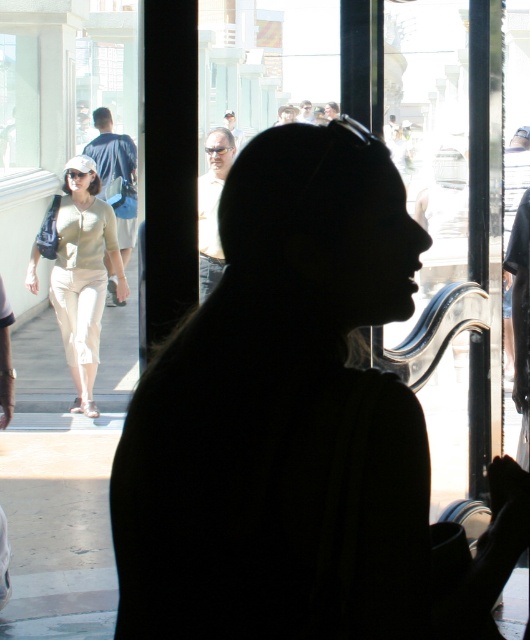
Looking at this image, you are a fashion designer observing the scene through the glass door. You notice the blue denim jacket at left and the matte beige shirt at center. Which clothing item appears larger in the image?

The blue denim jacket at left appears larger because it is much taller than the matte beige shirt at center.

You are standing in the room and looking through the glass door. You see a point at the center of the image. Is there an object at point (x=517, y=259) that could be part of a person wearing a black shirt?

Yes, the point (x=517, y=259) corresponds to the smooth black shirt at center, which is part of a person wearing a black shirt.

You are a fashion designer analyzing the clothing items in the image. Which clothing item, the smooth black shirt at center or the blue denim jacket at left, would you recommend for someone who wants to appear more dominant in a professional setting?

The smooth black shirt at center has a larger size compared to the blue denim jacket at left. In professional settings, larger clothing items can create a more authoritative and dominant appearance, so the smooth black shirt at center would be the better choice.